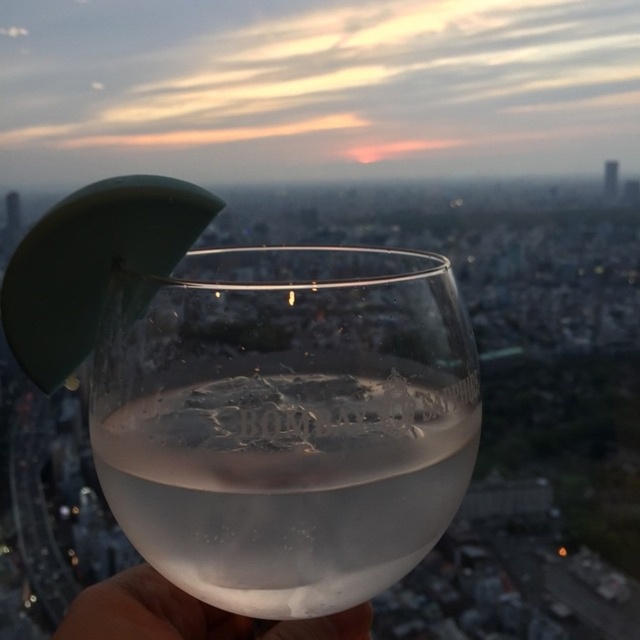
You are a bartender preparing a drink. You have a clear glass at center and a white matte hand at lower left. Which object is taller?

The clear glass at center is taller than the white matte hand at lower left according to the description.

You are a bartender preparing a drink and need to place the clear glass at center on a shelf that is 15 centimeters away from you. Can you safely place it there without moving closer?

The clear glass at center is 15.20 centimeters away from the viewer. Since the shelf is only 15 centimeters away, the glass is slightly farther than the shelf distance. Therefore, you cannot safely place it there without moving closer.

You are a bartender preparing a drink. You have a clear glass at center and a white matte hand at lower left. Which object is located to the right of the other?

The clear glass at center is positioned on the right side of white matte hand at lower left.